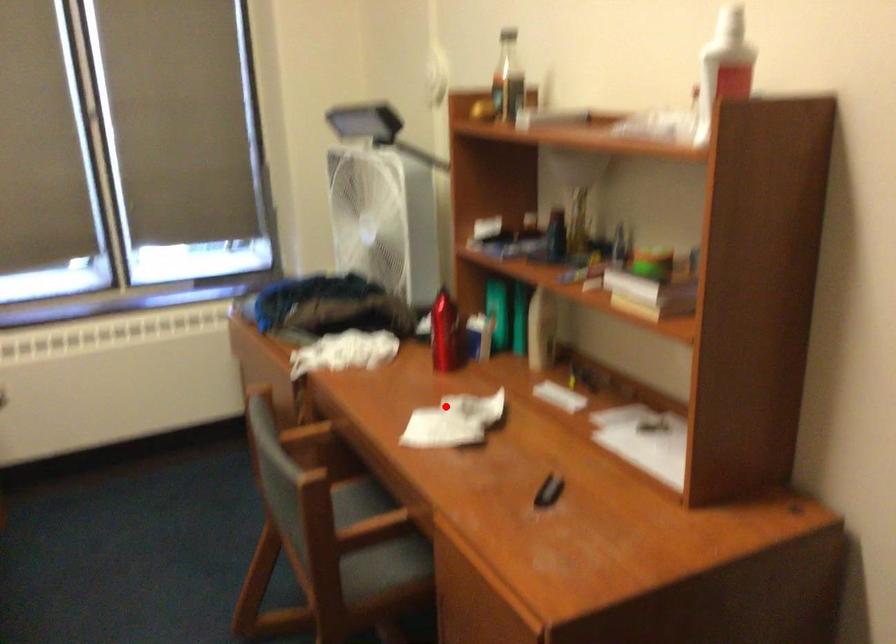
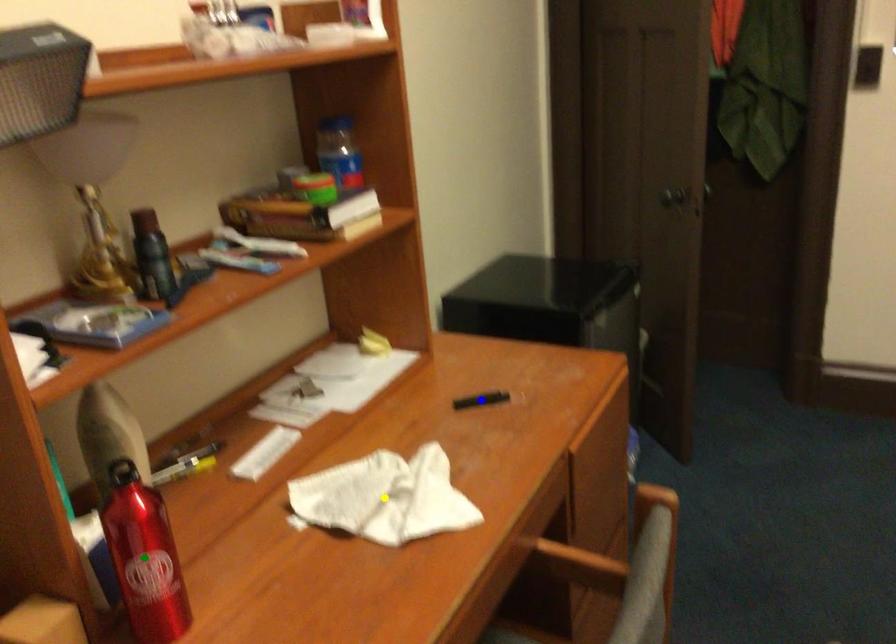
Question: I am providing you with two images of the same scene from different viewpoints. A red point is marked on the first image. You are given multiple points on the second image. Which spot in image 2 lines up with the point in image 1?

Choices:
 (A) blue point
 (B) green point
 (C) yellow point

Answer: (C)